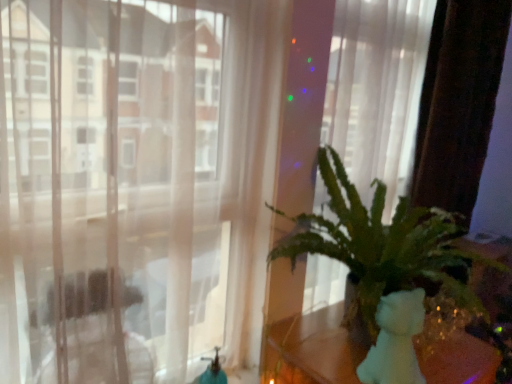
Question: Is green leafy plant at right taller than transparent curtain at center?

Choices:
 (A) no
 (B) yes

Answer: (A)

Question: Is the depth of green leafy plant at right less than that of transparent curtain at center?

Choices:
 (A) no
 (B) yes

Answer: (B)

Question: Is green leafy plant at right outside of transparent curtain at center?

Choices:
 (A) no
 (B) yes

Answer: (B)

Question: Does green leafy plant at right have a lesser width compared to transparent curtain at center?

Choices:
 (A) yes
 (B) no

Answer: (B)

Question: Is transparent curtain at center a part of green leafy plant at right?

Choices:
 (A) yes
 (B) no

Answer: (B)

Question: Is point (x=468, y=367) positioned closer to the camera than point (x=105, y=317)?

Choices:
 (A) closer
 (B) farther

Answer: (B)

Question: Is white matte teddy bear at right situated inside transparent curtain at center or outside?

Choices:
 (A) outside
 (B) inside

Answer: (A)

Question: From their relative heights in the image, would you say white matte teddy bear at right is taller or shorter than transparent curtain at center?

Choices:
 (A) tall
 (B) short

Answer: (B)

Question: From the image's perspective, is white matte teddy bear at right located above or below transparent curtain at center?

Choices:
 (A) above
 (B) below

Answer: (B)

Question: Considering the positions of point (269, 256) and point (2, 301), is point (269, 256) closer or farther from the camera than point (2, 301)?

Choices:
 (A) farther
 (B) closer

Answer: (A)

Question: Is green leafy plant at right taller or shorter than transparent curtain at center?

Choices:
 (A) short
 (B) tall

Answer: (A)

Question: In terms of width, does green leafy plant at right look wider or thinner when compared to transparent curtain at center?

Choices:
 (A) thin
 (B) wide

Answer: (B)

Question: Considering the positions of green leafy plant at right and transparent curtain at center in the image, is green leafy plant at right bigger or smaller than transparent curtain at center?

Choices:
 (A) big
 (B) small

Answer: (A)

Question: From their relative heights in the image, would you say transparent curtain at center is taller or shorter than green leafy plant at right?

Choices:
 (A) short
 (B) tall

Answer: (B)

Question: From a real-world perspective, is transparent curtain at center positioned above or below green leafy plant at right?

Choices:
 (A) below
 (B) above

Answer: (B)